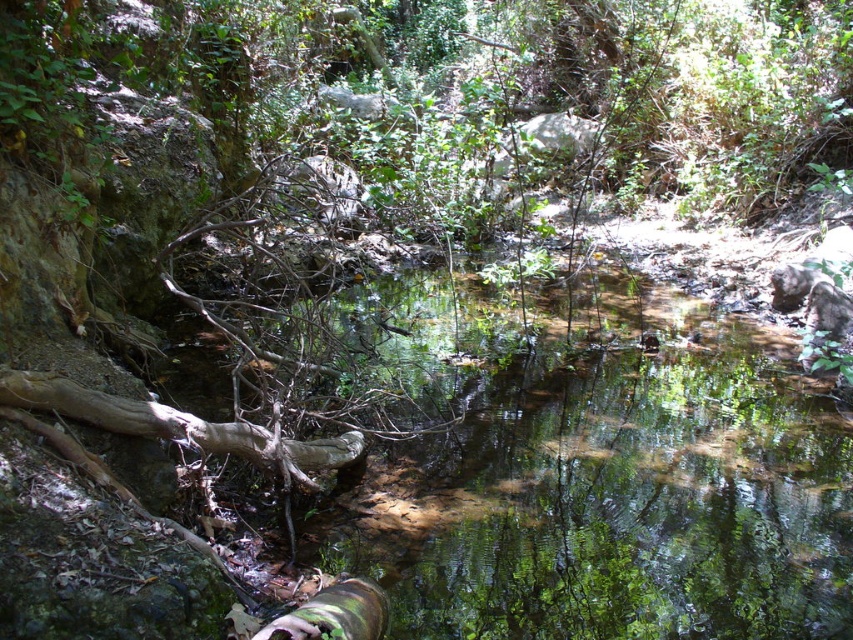
Does point (393, 340) come behind point (306, 621)?

Yes.

Between clear water at center and green mossy log at center, which one has less height?

green mossy log at center is shorter.

Where is `clear water at center`? The height and width of the screenshot is (640, 853). clear water at center is located at coordinates (601, 474).

Who is positioned more to the left, clear water at center or brown rough tree trunk at lower left?

From the viewer's perspective, brown rough tree trunk at lower left appears more on the left side.

Which is in front, point (682, 548) or point (292, 440)?

Point (682, 548) is more forward.

I want to click on clear water at center, so click(x=601, y=474).

Looking at this image, is brown rough tree trunk at lower left thinner than green mossy log at center?

Incorrect, brown rough tree trunk at lower left's width is not less than green mossy log at center's.

Does brown rough tree trunk at lower left have a larger size compared to green mossy log at center?

Correct, brown rough tree trunk at lower left is larger in size than green mossy log at center.

Describe the element at coordinates (178, 426) in the screenshot. This screenshot has height=640, width=853. I see `brown rough tree trunk at lower left` at that location.

I want to click on brown rough tree trunk at lower left, so coord(178,426).